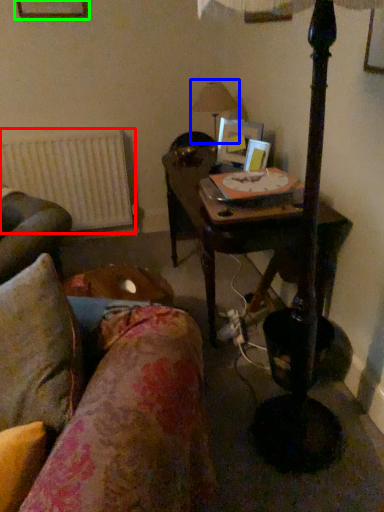
Question: Estimate the real-world distances between objects in this image. Which object is closer to radiator (highlighted by a red box), table lamp (highlighted by a blue box) or picture frame (highlighted by a green box)?

Choices:
 (A) table lamp
 (B) picture frame

Answer: (A)